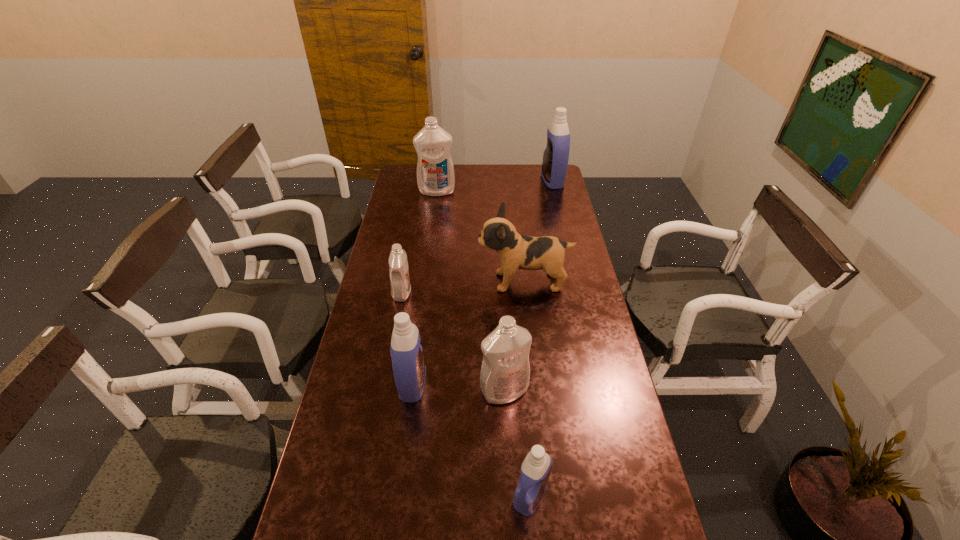
Locate an element on the screen. the nearest object is located at coordinates (535, 470).

Where is `the nearest blue detergent`? the nearest blue detergent is located at coordinates (535, 470).

You are a GUI agent. You are given a task and a screenshot of the screen. Output one action in this format:
    pyautogui.click(x=<x>, y=<y>)
    Task: Click on the blank space located on the front of the biggest white detergent
    Image resolution: width=960 pixels, height=540 pixels.
    Given the screenshot: What is the action you would take?
    (x=435, y=206)

I want to click on free spot located on the back of the rightmost blue detergent, so click(549, 166).

The width and height of the screenshot is (960, 540). I want to click on free space located at the face of the puppy, so click(x=400, y=281).

The image size is (960, 540). I want to click on vacant space located at the face of the puppy, so click(390, 281).

Identify the location of vacant space located 0.340m at the face of the puppy. The image size is (960, 540). point(390,281).

This screenshot has height=540, width=960. I want to click on vacant position located 0.200m on the front of the rightmost white detergent, so click(508, 475).

This screenshot has width=960, height=540. In order to click on free location located on the left of the second biggest blue detergent in this screenshot , I will do `click(371, 384)`.

In order to click on vacant space located 0.390m on the back of the smallest white detergent in this screenshot , I will do `click(415, 224)`.